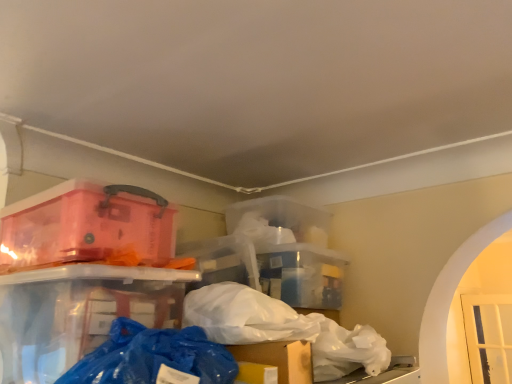
Question: Can white matte plastic bag at center, marked as the second plastic bag in a front-to-back arrangement, be found inside blue plastic bag at lower center, positioned as the first plastic bag in left-to-right order?

Choices:
 (A) no
 (B) yes

Answer: (A)

Question: From the image's perspective, is blue plastic bag at lower center, acting as the second plastic bag starting from the right, below white matte plastic bag at center, the second plastic bag from the left?

Choices:
 (A) no
 (B) yes

Answer: (A)

Question: Can we say blue plastic bag at lower center, acting as the first plastic bag starting from the front, lies outside white matte plastic bag at center, placed as the 1th plastic bag when sorted from back to front?

Choices:
 (A) yes
 (B) no

Answer: (A)

Question: From the image's perspective, is blue plastic bag at lower center, the second plastic bag from the back, on top of white matte plastic bag at center, placed as the 1th plastic bag when sorted from back to front?

Choices:
 (A) yes
 (B) no

Answer: (A)

Question: Can you confirm if blue plastic bag at lower center, acting as the second plastic bag starting from the right, is bigger than white matte plastic bag at center, the first plastic bag viewed from the right?

Choices:
 (A) no
 (B) yes

Answer: (A)

Question: From the image's perspective, is transparent plastic container at upper left positioned above or below white matte plastic bag at center, the first plastic bag viewed from the right?

Choices:
 (A) above
 (B) below

Answer: (A)

Question: Is transparent plastic container at upper left inside the boundaries of white matte plastic bag at center, the first plastic bag viewed from the right, or outside?

Choices:
 (A) outside
 (B) inside

Answer: (A)

Question: Is transparent plastic container at upper left in front of or behind white matte plastic bag at center, placed as the 1th plastic bag when sorted from back to front, in the image?

Choices:
 (A) front
 (B) behind

Answer: (A)

Question: Considering the positions of transparent plastic container at upper left and white matte plastic bag at center, the second plastic bag from the left, in the image, is transparent plastic container at upper left taller or shorter than white matte plastic bag at center, the second plastic bag from the left,?

Choices:
 (A) short
 (B) tall

Answer: (B)

Question: Considering the positions of white matte plastic bag at center, marked as the second plastic bag in a front-to-back arrangement, and transparent plastic container at upper left in the image, is white matte plastic bag at center, marked as the second plastic bag in a front-to-back arrangement, bigger or smaller than transparent plastic container at upper left?

Choices:
 (A) small
 (B) big

Answer: (A)

Question: Visually, is white matte plastic bag at center, marked as the second plastic bag in a front-to-back arrangement, positioned to the left or to the right of transparent plastic container at upper left?

Choices:
 (A) left
 (B) right

Answer: (B)

Question: From their relative heights in the image, would you say white matte plastic bag at center, the second plastic bag from the left, is taller or shorter than transparent plastic container at upper left?

Choices:
 (A) short
 (B) tall

Answer: (A)

Question: Relative to transparent plastic container at upper left, is white matte plastic bag at center, placed as the 1th plastic bag when sorted from back to front, in front or behind?

Choices:
 (A) front
 (B) behind

Answer: (B)

Question: Does point (366, 342) appear closer or farther from the camera than point (196, 342)?

Choices:
 (A) farther
 (B) closer

Answer: (A)

Question: From the image's perspective, is white matte plastic bag at center, marked as the second plastic bag in a front-to-back arrangement, located above or below blue plastic bag at lower center, positioned as the first plastic bag in left-to-right order?

Choices:
 (A) below
 (B) above

Answer: (A)